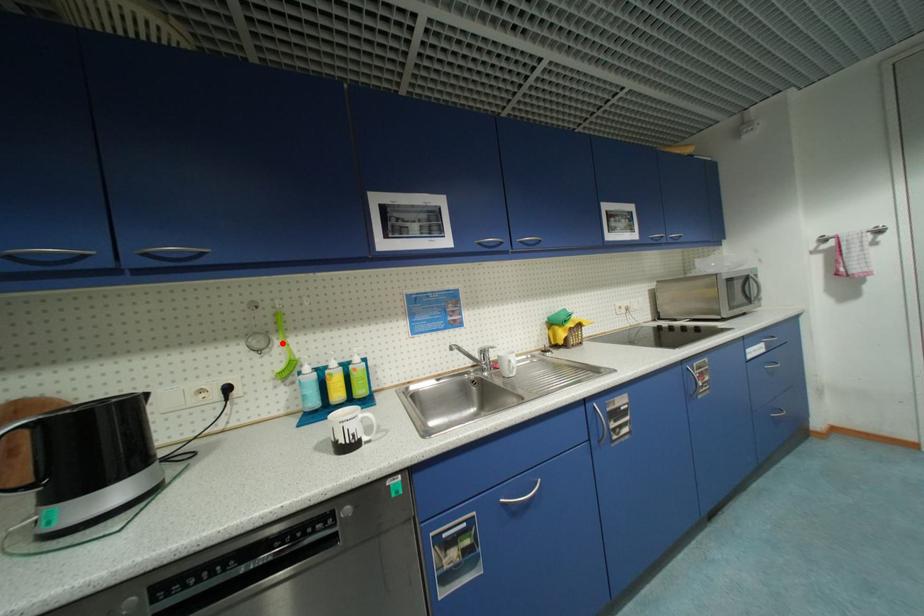
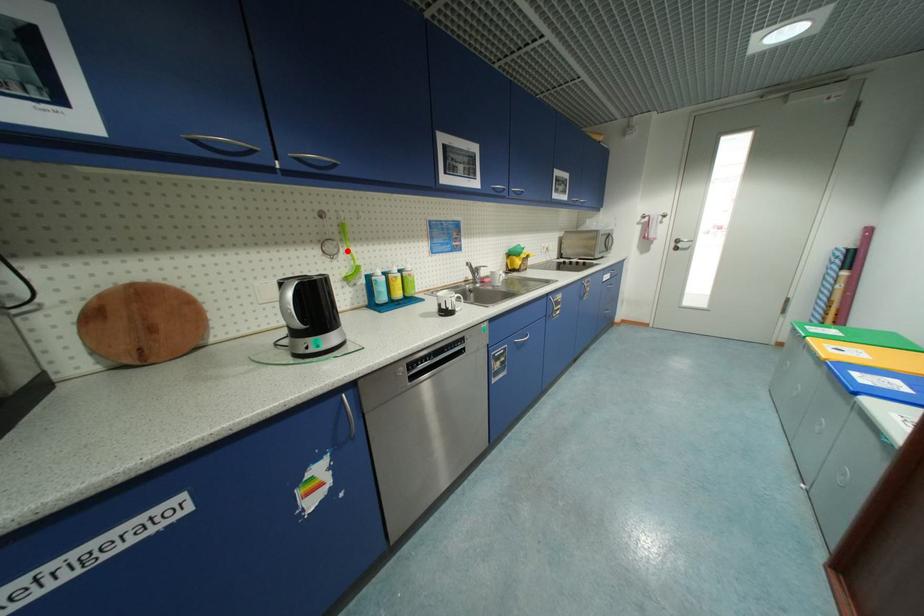
I am providing you with two images of the same scene from different viewpoints. A red point is marked on the first image and another point is marked on the second image. Is the red point in image1 aligned with the point shown in image2?

Yes